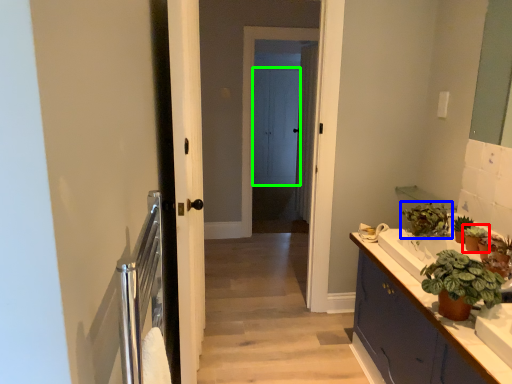
Question: Based on their relative distances, which object is farther from houseplant (highlighted by a red box)? Choose from houseplant (highlighted by a blue box) and screen door (highlighted by a green box).

Choices:
 (A) houseplant
 (B) screen door

Answer: (B)